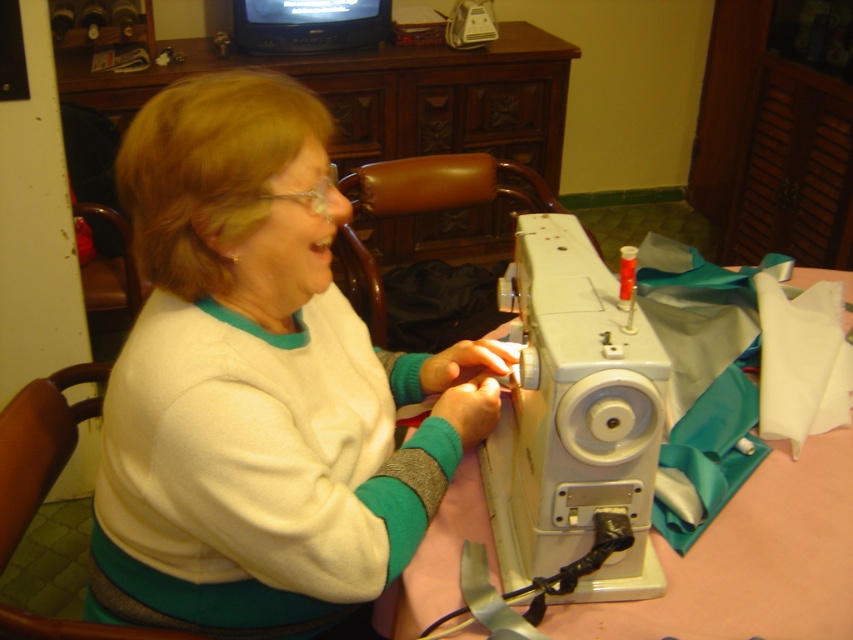
Between point (548, 547) and point (781, 593), which one is positioned in front?

Point (548, 547) is in front.

Is point (556, 413) less distant than point (840, 275)?

Yes.

Where is `white plastic sewing machine at center`? This screenshot has width=853, height=640. white plastic sewing machine at center is located at coordinates (573, 419).

Can you confirm if white fleece sweater at center is smaller than white plastic sewing machine at center?

No.

Is white fleece sweater at center bigger than white plastic sewing machine at center?

Yes, white fleece sweater at center is bigger than white plastic sewing machine at center.

Which is in front, point (321, 250) or point (639, 528)?

Point (321, 250)

Identify the location of white fleece sweater at center. The image size is (853, 640). (258, 385).

Is white fleece sweater at center positioned before pink fabric at lower center?

Yes, it is.

Is point (148, 492) less distant than point (718, 604)?

Yes, it is.

Which is in front, point (126, 385) or point (824, 548)?

Point (126, 385)

The height and width of the screenshot is (640, 853). I want to click on white fleece sweater at center, so click(x=258, y=385).